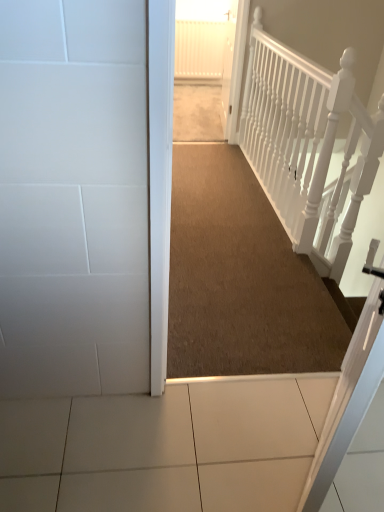
Question: From their relative heights in the image, would you say carpeted hallway at center is taller or shorter than white textured rail at upper right?

Choices:
 (A) tall
 (B) short

Answer: (B)

Question: From the image's perspective, is carpeted hallway at center positioned above or below white textured rail at upper right?

Choices:
 (A) below
 (B) above

Answer: (B)

Question: Based on their relative distances, which object is farther from the brown carpet at center?

Choices:
 (A) white textured rail at upper right
 (B) carpeted hallway at center

Answer: (B)

Question: Which object is the farthest from the white textured rail at upper right?

Choices:
 (A) carpeted hallway at center
 (B) brown carpet at center

Answer: (A)